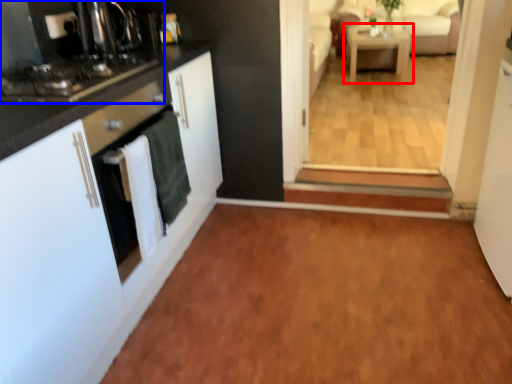
Question: Which object is further to the camera taking this photo, table (highlighted by a red box) or home appliance (highlighted by a blue box)?

Choices:
 (A) table
 (B) home appliance

Answer: (A)